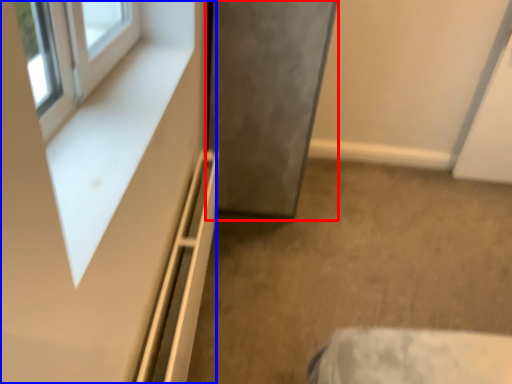
Question: Which object appears closest to the camera in this image, door (highlighted by a red box) or dresser (highlighted by a blue box)?

Choices:
 (A) door
 (B) dresser

Answer: (B)